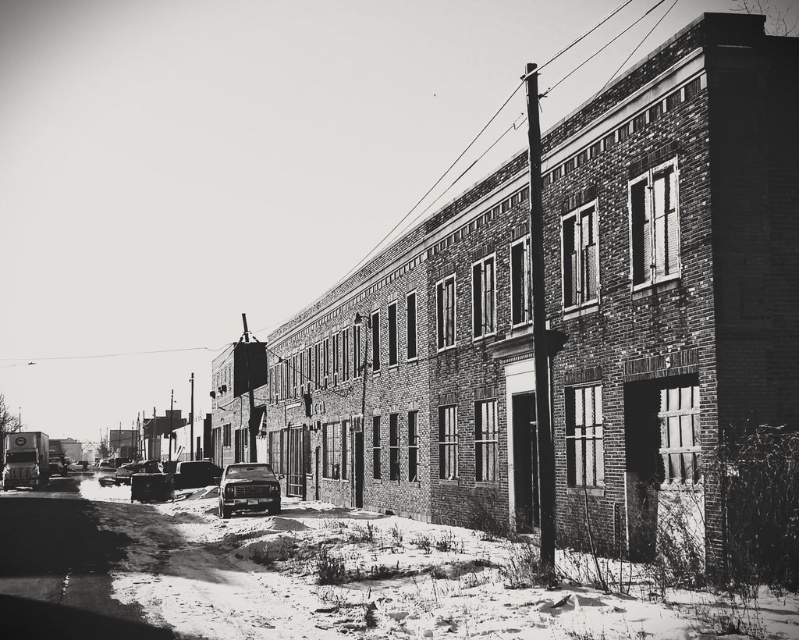
You are a delivery person trying to park your truck in the spot where the shiny black sedan at center and the shiny black car at center are currently parked. Which vehicle should you move first to make space?

The shiny black sedan at center is in front of the shiny black car at center, so you should move the shiny black sedan at center first to access the space behind it.

You are a delivery person trying to park your van, which is 5 meters long, in the space between the shiny black sedan at center and the shiny black car at center. According to the scene, which one is shorter so you can determine if there is enough space?

The shiny black sedan at center is shorter than the shiny black car at center. Therefore, the space between them may be sufficient for your 5 meter long van if the distance between the two vehicles is greater than 5 meters. However, since the exact distance isn not provided, you should measure the space before proceeding.